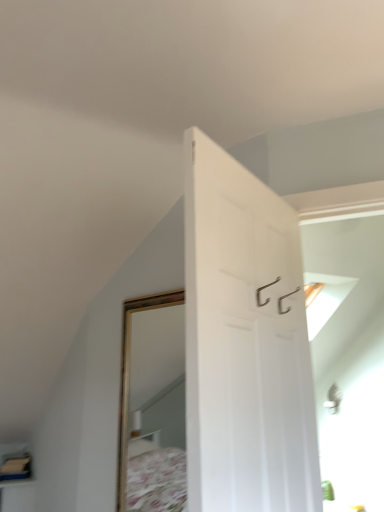
You are a GUI agent. You are given a task and a screenshot of the screen. Output one action in this format:
    pyautogui.click(x=<x>, y=<y>)
    Task: Click on the white matte door at center
    The height and width of the screenshot is (512, 384).
    Given the screenshot: What is the action you would take?
    pyautogui.click(x=245, y=343)

What do you see at coordinates (245, 343) in the screenshot? I see `white matte door at center` at bounding box center [245, 343].

Locate an element on the screen. Image resolution: width=384 pixels, height=512 pixels. wooden shelf at lower left is located at coordinates (16, 466).

Describe the element at coordinates (16, 466) in the screenshot. I see `wooden shelf at lower left` at that location.

Locate an element on the screen. white matte door at center is located at coordinates (245, 343).

Visually, is wooden shelf at lower left positioned to the left or to the right of white matte door at center?

wooden shelf at lower left is to the left of white matte door at center.

Is wooden shelf at lower left in front of or behind white matte door at center in the image?

Visually, wooden shelf at lower left is located behind white matte door at center.

Is point (7, 458) closer or farther from the camera than point (264, 206)?

Point (7, 458) is positioned farther from the camera compared to point (264, 206).

From the image's perspective, does wooden shelf at lower left appear lower than white matte door at center?

Indeed, from the image's perspective, wooden shelf at lower left is shown beneath white matte door at center.

From a real-world perspective, which is physically below, wooden shelf at lower left or white matte door at center?

From a 3D spatial view, wooden shelf at lower left is below.

Is wooden shelf at lower left wider than white matte door at center?

Yes.

Can you confirm if wooden shelf at lower left is taller than white matte door at center?

In fact, wooden shelf at lower left may be shorter than white matte door at center.

Based on the photo, in terms of size, does wooden shelf at lower left appear bigger or smaller than white matte door at center?

Considering their sizes, wooden shelf at lower left takes up less space than white matte door at center.

Is white matte door at center surrounded by wooden shelf at lower left?

Definitely not — white matte door at center is not inside wooden shelf at lower left.

Are wooden shelf at lower left and white matte door at center beside each other?

wooden shelf at lower left is not next to white matte door at center, and they're not touching.

Is wooden shelf at lower left aimed at white matte door at center?

Yes, wooden shelf at lower left is oriented towards white matte door at center.

What's the angular difference between wooden shelf at lower left and white matte door at center's facing directions?

There is a 34.5-degree angle between the facing directions of wooden shelf at lower left and white matte door at center.

How distant is wooden shelf at lower left from white matte door at center?

wooden shelf at lower left is 2.21 meters away from white matte door at center.

At what (x,y) coordinates should I click in order to perform the action: click on door located above the wooden shelf at lower left (from a real-world perspective). Please return your answer as a coordinate pair (x, y). The height and width of the screenshot is (512, 384). Looking at the image, I should click on (245, 343).

Considering the positions of objects white matte door at center and wooden shelf at lower left in the image provided, who is more to the left, white matte door at center or wooden shelf at lower left?

From the viewer's perspective, wooden shelf at lower left appears more on the left side.

Does white matte door at center lie in front of wooden shelf at lower left?

That is True.

Does point (262, 324) lie in front of point (27, 453)?

Yes, point (262, 324) is in front of point (27, 453).

From the image's perspective, is white matte door at center positioned above or below wooden shelf at lower left?

white matte door at center is situated higher than wooden shelf at lower left in the image.

From a real-world perspective, is white matte door at center under wooden shelf at lower left?

Actually, white matte door at center is physically above wooden shelf at lower left in the real world.

Looking at their sizes, would you say white matte door at center is wider or thinner than wooden shelf at lower left?

white matte door at center is thinner than wooden shelf at lower left.

Considering the sizes of white matte door at center and wooden shelf at lower left in the image, is white matte door at center taller or shorter than wooden shelf at lower left?

white matte door at center is taller than wooden shelf at lower left.

Is white matte door at center bigger or smaller than wooden shelf at lower left?

Considering their sizes, white matte door at center takes up more space than wooden shelf at lower left.

Would you say wooden shelf at lower left is part of white matte door at center's contents?

Actually, wooden shelf at lower left is outside white matte door at center.

Is white matte door at center next to wooden shelf at lower left?

There is a gap between white matte door at center and wooden shelf at lower left.

From the picture: Could you tell me if white matte door at center is facing wooden shelf at lower left?

No.

This screenshot has width=384, height=512. I want to click on shelf that appears below the white matte door at center (from a real-world perspective), so click(x=16, y=466).

Image resolution: width=384 pixels, height=512 pixels. What are the coordinates of `door that appears in front of the wooden shelf at lower left` in the screenshot? It's located at (245, 343).

What are the coordinates of `door on the right side of wooden shelf at lower left` in the screenshot? It's located at (245, 343).